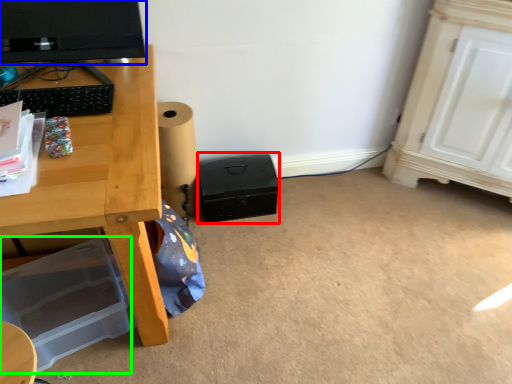
Question: Considering the real-world distances, which object is closest to box (highlighted by a red box)? computer monitor (highlighted by a blue box) or box (highlighted by a green box).

Choices:
 (A) computer monitor
 (B) box

Answer: (B)